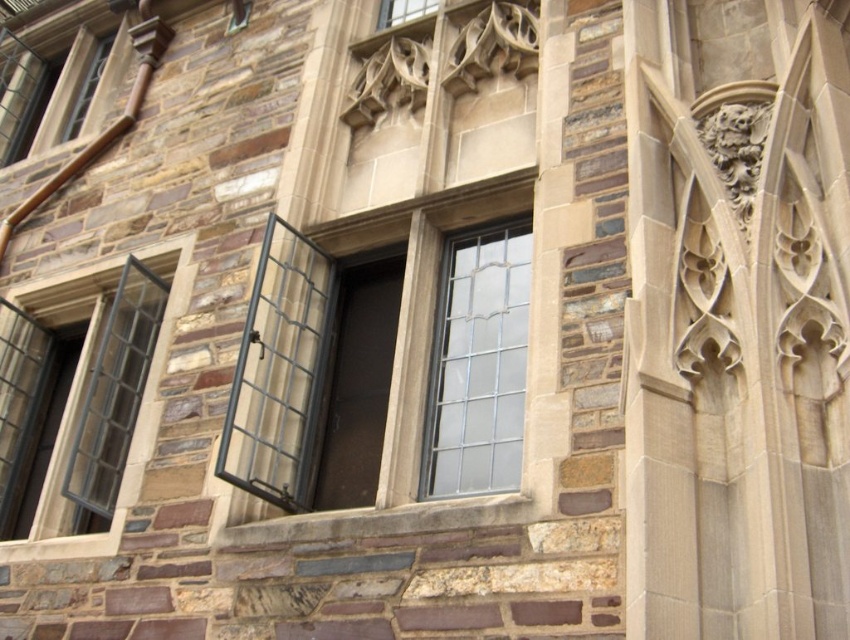
You are standing in front of a building with a mix of stone and brick materials. You notice a clear glass window at center and a black metal frame window with grid pattern. Which window is located at the point with coordinates (479, 365)?

The clear glass window at center is located at point (479, 365).

You are standing in front of the building and want to touch both point (486, 269) and point (422, 13) on the facade. Which point will you reach first?

Point (486, 269) is closer to the viewer than point (422, 13), so you will reach point (486, 269) first.